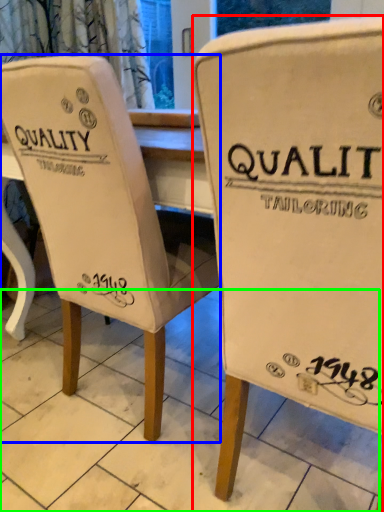
Question: Considering the real-world distances, which object is closest to chair (highlighted by a red box)? chair (highlighted by a blue box) or tile (highlighted by a green box).

Choices:
 (A) chair
 (B) tile

Answer: (A)